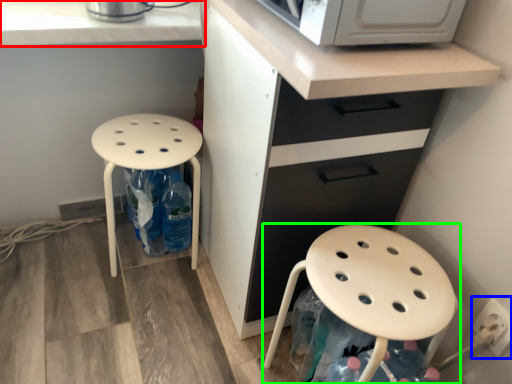
Question: Based on their relative distances, which object is nearer to countertop (highlighted by a red box)? Choose from electric outlet (highlighted by a blue box) and stool (highlighted by a green box).

Choices:
 (A) electric outlet
 (B) stool

Answer: (B)